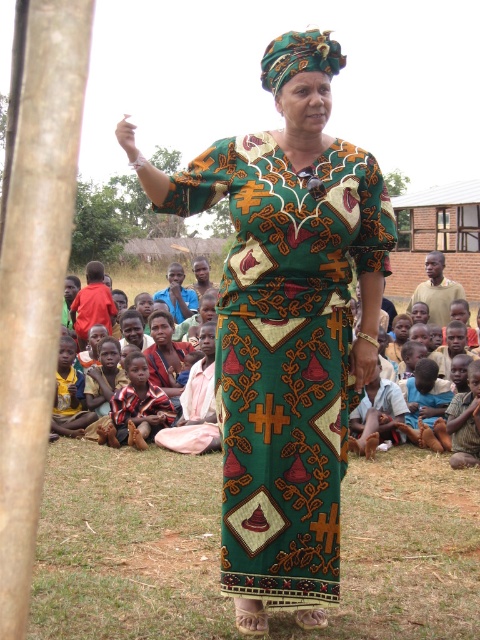
Question: Among these points, which one is nearest to the camera?

Choices:
 (A) (323, 476)
 (B) (21, 355)

Answer: (B)

Question: Is the position of green woven dress at center more distant than that of brown rough tree trunk at left?

Choices:
 (A) yes
 (B) no

Answer: (A)

Question: Which point is farther from the camera taking this photo?

Choices:
 (A) (26, 387)
 (B) (231, 520)

Answer: (B)

Question: Can you confirm if green woven dress at center is smaller than brown rough tree trunk at left?

Choices:
 (A) no
 (B) yes

Answer: (A)

Question: Observing the image, what is the correct spatial positioning of green woven dress at center in reference to brown rough tree trunk at left?

Choices:
 (A) below
 (B) above

Answer: (A)